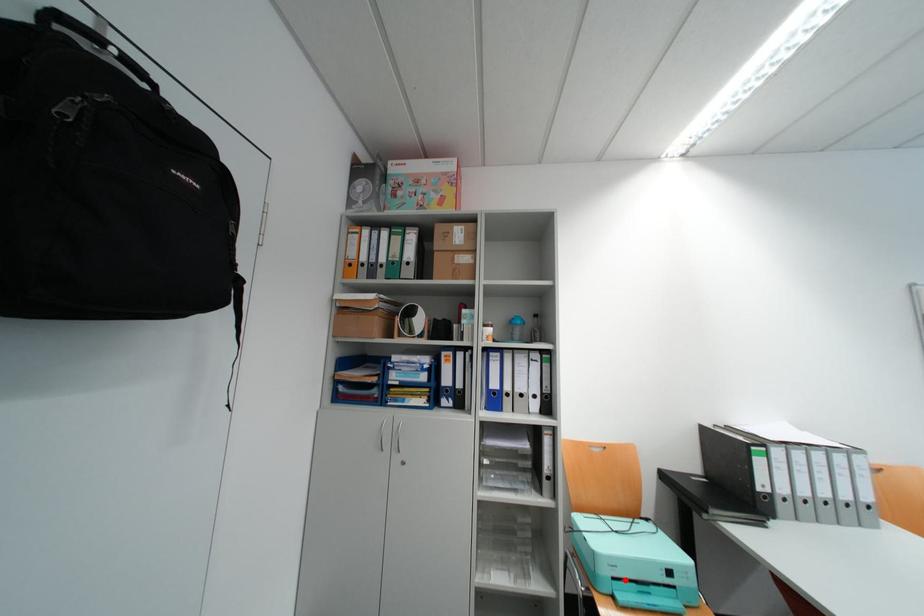
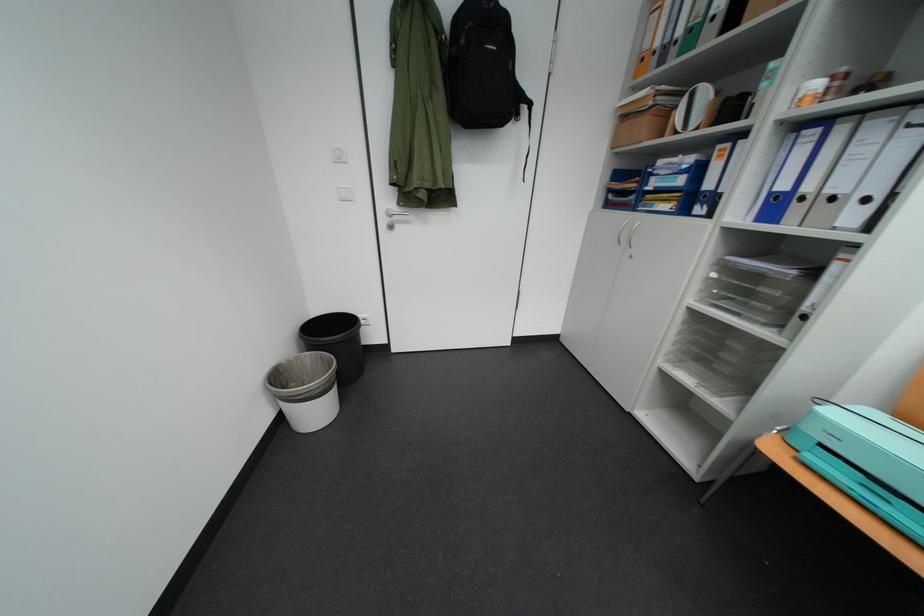
Where in the second image is the point corresponding to the highlighted location from the first image?

(833, 447)